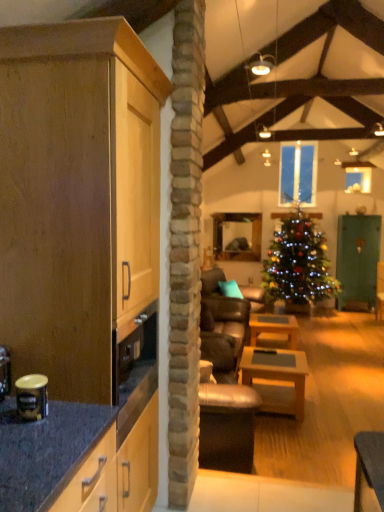
What do you see at coordinates (273, 330) in the screenshot?
I see `wooden table at center, which is counted as the second table, starting from the front` at bounding box center [273, 330].

Measure the distance between green matte cabinet at right and camera.

green matte cabinet at right is 6.93 meters from camera.

This screenshot has width=384, height=512. What do you see at coordinates (358, 257) in the screenshot? I see `green matte cabinet at right` at bounding box center [358, 257].

Describe the element at coordinates (80, 263) in the screenshot. The image size is (384, 512). I see `light wood cabinet at left` at that location.

Find the location of a particular element. wooden at upper center is located at coordinates (300, 77).

The width and height of the screenshot is (384, 512). I want to click on teal fabric pillow at center, so click(230, 289).

Consider the image. From the image's perspective, would you say shiny green christmas tree at center is shown under wooden at upper center?

Yes, from the image's perspective, shiny green christmas tree at center is beneath wooden at upper center.

Can you tell me how much shiny green christmas tree at center and wooden at upper center differ in facing direction?

The facing directions of shiny green christmas tree at center and wooden at upper center are 0.543 degrees apart.

Is wooden at upper center inside shiny green christmas tree at center?

Definitely not — wooden at upper center is not inside shiny green christmas tree at center.

Who is taller, green matte cabinet at right or wooden at upper center?

With more height is green matte cabinet at right.

Would you say green matte cabinet at right is to the left or to the right of wooden at upper center in the picture?

In the image, green matte cabinet at right appears on the right side of wooden at upper center.

Considering the relative sizes of green matte cabinet at right and wooden at upper center in the image provided, is green matte cabinet at right thinner than wooden at upper center?

In fact, green matte cabinet at right might be wider than wooden at upper center.

In the scene shown: Which is farther from the camera, (28, 405) or (272, 333)?

Positioned behind is point (272, 333).

In terms of width, does metallic gold canister at left look wider or thinner when compared to wooden table at center, marked as the first table in a back-to-front arrangement?

metallic gold canister at left is thinner than wooden table at center, marked as the first table in a back-to-front arrangement.

Find the location of a particular element. The height and width of the screenshot is (512, 384). table that is the 2nd one when counting rightward from the metallic gold canister at left is located at coordinates (273, 330).

Can you confirm if metallic gold canister at left is shorter than wooden table at center, marked as the first table in a back-to-front arrangement?

Yes.

Which of these two, light wood cabinet at left or clear glass window at center, stands shorter?

clear glass window at center is shorter.

Identify the location of window lying above the light wood cabinet at left (from the image's perspective). (298, 174).

Is point (53, 262) closer or farther from the camera than point (300, 161)?

Clearly, point (53, 262) is closer to the camera than point (300, 161).

Which is behind, point (295, 183) or point (283, 333)?

Point (295, 183)

Does clear glass window at center have a larger size compared to wooden table at center, which is counted as the second table, starting from the front?

No, clear glass window at center is not bigger than wooden table at center, which is counted as the second table, starting from the front.

What's the angular difference between clear glass window at center and wooden table at center, marked as the first table in a back-to-front arrangement,'s facing directions?

There is a 92.4-degree angle between the facing directions of clear glass window at center and wooden table at center, marked as the first table in a back-to-front arrangement.

In order to click on window above the wooden table at center, which is counted as the second table, starting from the front (from the image's perspective) in this screenshot , I will do `click(298, 174)`.

Looking at this image, from a real-world perspective, does light wood cabinet at left sit lower than wooden table at center, which is counted as the second table, starting from the front?

Incorrect, from a real-world perspective, light wood cabinet at left is higher than wooden table at center, which is counted as the second table, starting from the front.

Consider the image. Is light wood cabinet at left bigger or smaller than wooden table at center, which is counted as the second table, starting from the front?

light wood cabinet at left is bigger than wooden table at center, which is counted as the second table, starting from the front.

Between light wood cabinet at left and wooden table at center, which is counted as the second table, starting from the front, which one has smaller width?

Thinner between the two is wooden table at center, which is counted as the second table, starting from the front.

How distant is light wood cabinet at left from wooden table at center, which is counted as the second table, starting from the front?

A distance of 9.96 feet exists between light wood cabinet at left and wooden table at center, which is counted as the second table, starting from the front.

Is shiny green christmas tree at center inside the boundaries of wooden table at center, acting as the second table starting from the back, or outside?

shiny green christmas tree at center lies outside wooden table at center, acting as the second table starting from the back.

Does shiny green christmas tree at center have a greater height compared to wooden table at center, which is the 1th table in front-to-back order?

Yes.

Between shiny green christmas tree at center and wooden table at center, which is the 1th table in front-to-back order, which one has larger width?

shiny green christmas tree at center is wider.

From the image's perspective, which is below, shiny green christmas tree at center or wooden table at center, which is the 1th table in front-to-back order?

wooden table at center, which is the 1th table in front-to-back order, from the image's perspective.

I want to click on christmas tree that appears behind the wooden at upper center, so click(x=298, y=264).

This screenshot has width=384, height=512. What are the coordinates of `glass door below the wooden at upper center (from a real-world perspective)` in the screenshot? It's located at (358, 257).

Estimate the real-world distances between objects in this image. Which object is further from metallic gold canister at left, wooden table at center, marked as the first table in a back-to-front arrangement, or light wood cabinet at left?

wooden table at center, marked as the first table in a back-to-front arrangement.

From the image, which object appears to be farther from shiny green christmas tree at center, wooden table at center, marked as the first table in a back-to-front arrangement, or wooden at upper center?

Among the two, wooden at upper center is located further to shiny green christmas tree at center.

Considering their positions, is wooden at upper center positioned further to green matte cabinet at right than shiny green christmas tree at center?

wooden at upper center lies further to green matte cabinet at right than the other object.

From the image, which object appears to be farther from green matte cabinet at right, clear glass window at center or shiny green christmas tree at center?

clear glass window at center is positioned further to the anchor green matte cabinet at right.

From the image, which object appears to be nearer to green matte cabinet at right, clear glass window at center or teal fabric pillow at center?

Based on the image, clear glass window at center appears to be nearer to green matte cabinet at right.

Which object lies nearer to the anchor point teal fabric pillow at center, light wood cabinet at left or clear glass window at center?

Among the two, clear glass window at center is located nearer to teal fabric pillow at center.

Looking at the image, which one is located closer to green matte cabinet at right, clear glass window at center or wooden table at center, which is the 1th table in front-to-back order?

clear glass window at center.

Estimate the real-world distances between objects in this image. Which object is closer to clear glass window at center, wooden at upper center or wooden table at center, which is counted as the second table, starting from the front?

wooden at upper center lies closer to clear glass window at center than the other object.

The width and height of the screenshot is (384, 512). I want to click on exhaust hood between light wood cabinet at left and wooden table at center, which is counted as the second table, starting from the front, from front to back, so click(x=300, y=77).

Locate an element on the screen. This screenshot has width=384, height=512. christmas tree positioned between wooden at upper center and green matte cabinet at right from near to far is located at coordinates (298, 264).

Image resolution: width=384 pixels, height=512 pixels. I want to click on christmas tree between light wood cabinet at left and clear glass window at center in the front-back direction, so click(298, 264).

In order to click on window located between teal fabric pillow at center and green matte cabinet at right in the left-right direction in this screenshot , I will do `click(298, 174)`.